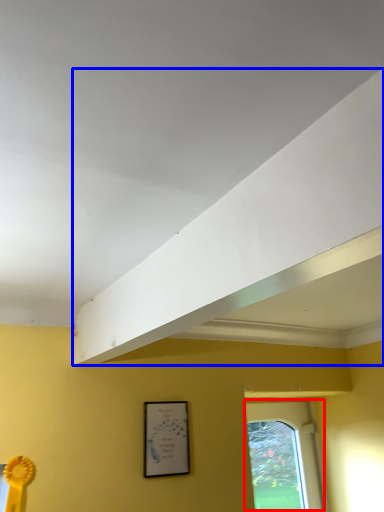
Question: Which of the following is the farthest to the observer, window (highlighted by a red box) or exhaust hood (highlighted by a blue box)?

Choices:
 (A) window
 (B) exhaust hood

Answer: (A)